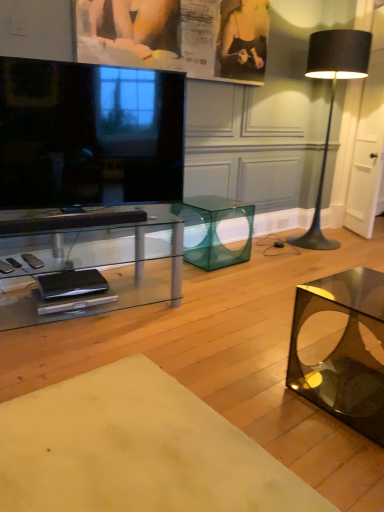
Question: From a real-world perspective, is black matte floor lamp at right on clear glass table at center, the second table positioned from the front?

Choices:
 (A) yes
 (B) no

Answer: (A)

Question: Considering the relative sizes of black matte floor lamp at right and clear glass table at center, which is the 2th table from back to front, in the image provided, is black matte floor lamp at right wider than clear glass table at center, which is the 2th table from back to front,?

Choices:
 (A) no
 (B) yes

Answer: (B)

Question: Considering the relative positions of black matte floor lamp at right and clear glass table at center, which is the 2th table from back to front, in the image provided, is black matte floor lamp at right to the right of clear glass table at center, which is the 2th table from back to front, from the viewer's perspective?

Choices:
 (A) yes
 (B) no

Answer: (A)

Question: Does black matte floor lamp at right appear on the left side of clear glass table at center, the second table positioned from the front?

Choices:
 (A) no
 (B) yes

Answer: (A)

Question: Is the depth of black matte floor lamp at right less than that of clear glass table at center, the second table positioned from the front?

Choices:
 (A) no
 (B) yes

Answer: (A)

Question: Is matte paper poster at upper center wider or thinner than clear glass table at center, the second table positioned from the front?

Choices:
 (A) wide
 (B) thin

Answer: (B)

Question: From their relative heights in the image, would you say matte paper poster at upper center is taller or shorter than clear glass table at center, which is the 2th table from back to front?

Choices:
 (A) tall
 (B) short

Answer: (A)

Question: From a real-world perspective, is matte paper poster at upper center above or below clear glass table at center, the second table positioned from the front?

Choices:
 (A) below
 (B) above

Answer: (B)

Question: Would you say matte paper poster at upper center is inside or outside clear glass table at center, which is the 2th table from back to front?

Choices:
 (A) inside
 (B) outside

Answer: (B)

Question: Based on their positions, is matte paper poster at upper center located to the left or right of smooth cream fabric at lower center, the 1th table when ordered from front to back?

Choices:
 (A) right
 (B) left

Answer: (A)

Question: Does point 81,19 appear closer or farther from the camera than point 230,475?

Choices:
 (A) closer
 (B) farther

Answer: (B)

Question: From the image's perspective, is matte paper poster at upper center positioned above or below smooth cream fabric at lower center, acting as the 3th table starting from the back?

Choices:
 (A) below
 (B) above

Answer: (B)

Question: Considering their positions, is matte paper poster at upper center located in front of or behind smooth cream fabric at lower center, the 1th table when ordered from front to back?

Choices:
 (A) behind
 (B) front

Answer: (A)

Question: From a real-world perspective, is black glossy television at left positioned above or below black matte floor lamp at right?

Choices:
 (A) below
 (B) above

Answer: (B)

Question: Would you say black glossy television at left is inside or outside black matte floor lamp at right?

Choices:
 (A) inside
 (B) outside

Answer: (B)